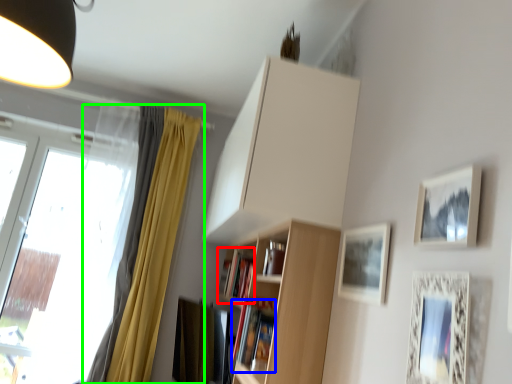
Question: Estimate the real-world distances between objects in this image. Which object is closer to book (highlighted by a red box), book (highlighted by a blue box) or curtain (highlighted by a green box)?

Choices:
 (A) book
 (B) curtain

Answer: (A)